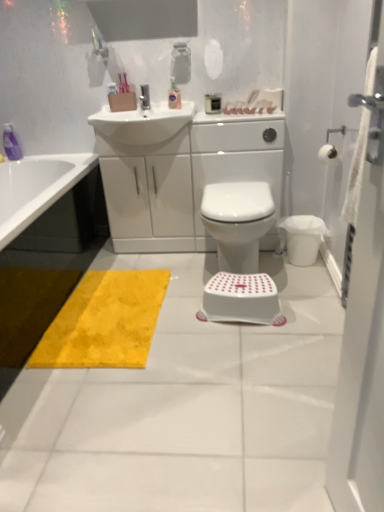
Locate an element on the screen. unoccupied region to the right of yellow fuzzy rug at lower left is located at coordinates (235, 327).